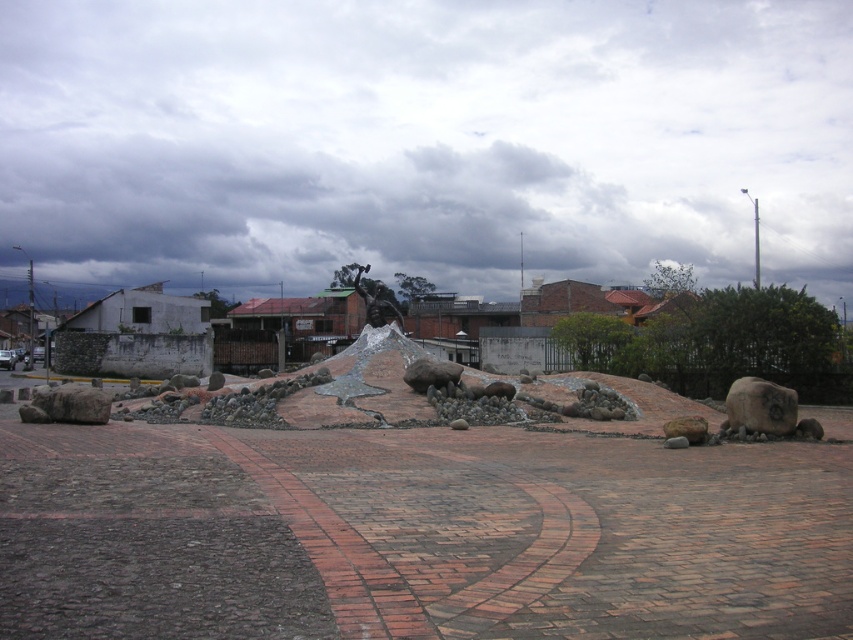
You are standing in the outdoor area with a 15 meter long rope. You want to tie the rope from your current position to the smooth gray rock at right. Is the rope long enough?

The distance between you and the smooth gray rock at right is 14.49 meters, so the 15 meter long rope is sufficient to reach it.

You are a landscape architect designing a garden pathway. You have two elements to place in the design based on the image provided. The smooth gray rock at right and the shiny bronze statue at center. Which object should be placed closer to the entrance of the pathway to ensure it is more visible to visitors?

The shiny bronze statue at center should be placed closer to the entrance of the pathway because it is larger than the smooth gray rock at right, making it more visible to visitors.